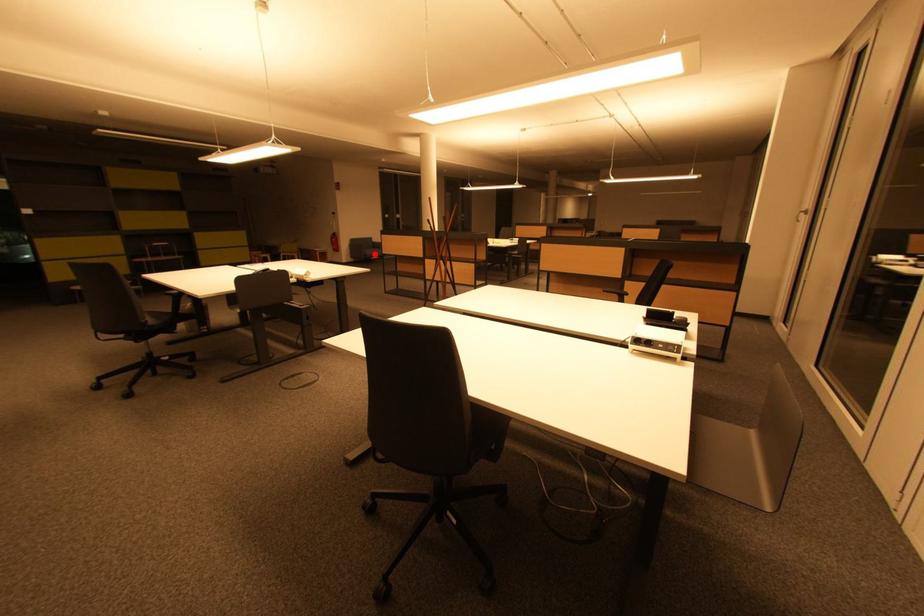
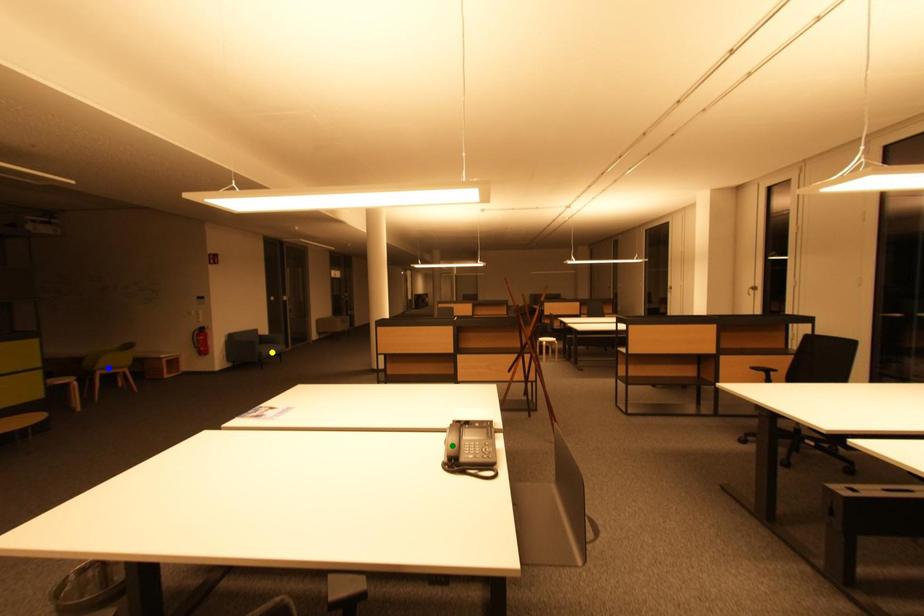
Question: I am providing you with two images of the same scene from different viewpoints. A red point is marked on the first image. You are given multiple points on the second image. Which spot in image 2 lines up with the point in image 1?

Choices:
 (A) green point
 (B) blue point
 (C) yellow point

Answer: (C)